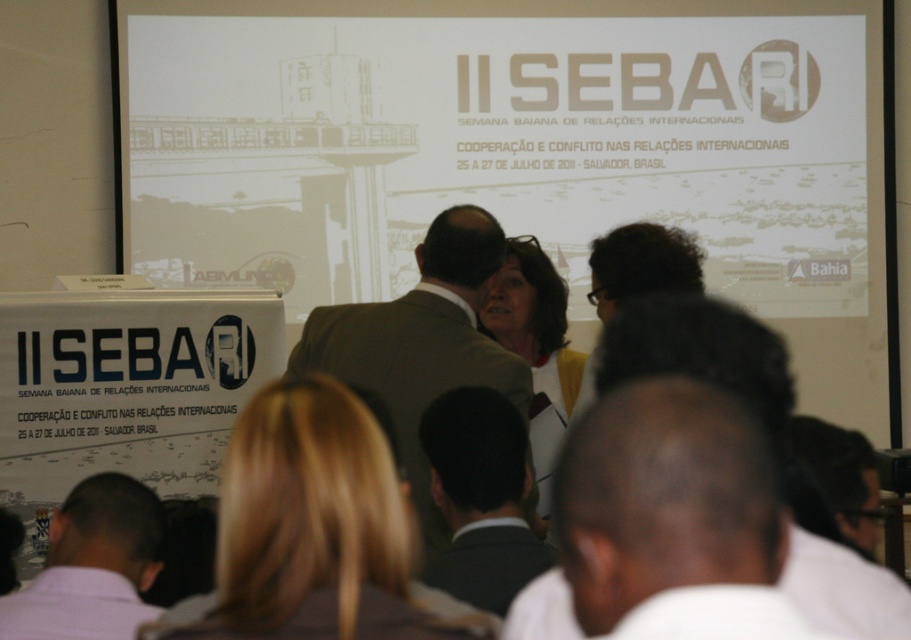
You are an event organizer and need to ensure that all participants can see the presentation screen clearly. Considering the dark hair at center and the dark brown suit at center, which object is smaller and might not block the view of others?

The dark hair at center occupies less space than the dark brown suit at center, so the dark hair at center is smaller and less likely to block the view compared to the dark brown suit at center.

You are organizing a photo shoot and need to place a red banner between the pink shirt at lower left and the yellow fabric at center. Since the banner must be placed between them, which object should the banner be closer to?

The banner should be closer to the pink shirt at lower left because it is smaller in size compared to the yellow fabric at center, allowing more space between them.